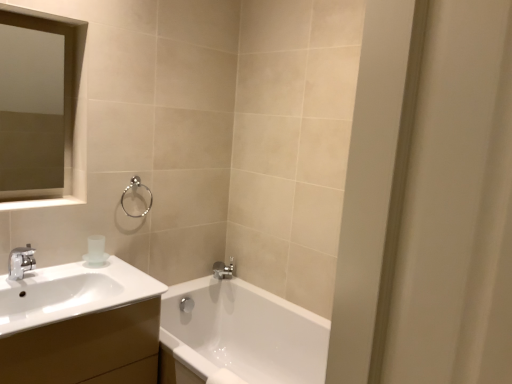
Question: Can you confirm if transparent frosted glass cup at upper left is thinner than white glossy balustrade at upper left?

Choices:
 (A) yes
 (B) no

Answer: (A)

Question: Is transparent frosted glass cup at upper left taller than white glossy balustrade at upper left?

Choices:
 (A) no
 (B) yes

Answer: (B)

Question: Is transparent frosted glass cup at upper left far away from white glossy balustrade at upper left?

Choices:
 (A) no
 (B) yes

Answer: (A)

Question: Can you confirm if transparent frosted glass cup at upper left is shorter than white glossy balustrade at upper left?

Choices:
 (A) yes
 (B) no

Answer: (B)

Question: Is transparent frosted glass cup at upper left at the left side of white glossy balustrade at upper left?

Choices:
 (A) yes
 (B) no

Answer: (B)

Question: Is polished chrome faucet at lower center taller or shorter than satin silver towel ring at upper center?

Choices:
 (A) tall
 (B) short

Answer: (B)

Question: Considering the positions of polished chrome faucet at lower center and satin silver towel ring at upper center in the image, is polished chrome faucet at lower center wider or thinner than satin silver towel ring at upper center?

Choices:
 (A) wide
 (B) thin

Answer: (A)

Question: Based on their positions, is polished chrome faucet at lower center located to the left or right of satin silver towel ring at upper center?

Choices:
 (A) right
 (B) left

Answer: (A)

Question: From the image's perspective, relative to satin silver towel ring at upper center, is polished chrome faucet at lower center above or below?

Choices:
 (A) below
 (B) above

Answer: (A)

Question: Considering the positions of transparent frosted glass cup at upper left and polished chrome faucet at lower center in the image, is transparent frosted glass cup at upper left wider or thinner than polished chrome faucet at lower center?

Choices:
 (A) thin
 (B) wide

Answer: (A)

Question: Is transparent frosted glass cup at upper left to the left or to the right of polished chrome faucet at lower center in the image?

Choices:
 (A) right
 (B) left

Answer: (B)

Question: From a real-world perspective, relative to polished chrome faucet at lower center, is transparent frosted glass cup at upper left vertically above or below?

Choices:
 (A) below
 (B) above

Answer: (B)

Question: Considering the positions of transparent frosted glass cup at upper left and polished chrome faucet at lower center in the image, is transparent frosted glass cup at upper left bigger or smaller than polished chrome faucet at lower center?

Choices:
 (A) big
 (B) small

Answer: (B)

Question: In terms of size, does satin silver towel ring at upper center appear bigger or smaller than white glossy cabinet at left?

Choices:
 (A) big
 (B) small

Answer: (B)

Question: From the image's perspective, relative to white glossy cabinet at left, is satin silver towel ring at upper center above or below?

Choices:
 (A) above
 (B) below

Answer: (A)